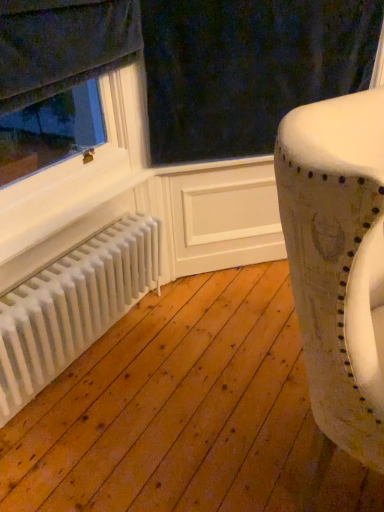
Question: In the image, is white matte radiator at lower left positioned in front of or behind distressed leather chair at right?

Choices:
 (A) front
 (B) behind

Answer: (B)

Question: In terms of size, does white matte radiator at lower left appear bigger or smaller than distressed leather chair at right?

Choices:
 (A) small
 (B) big

Answer: (A)

Question: Considering the positions of white matte radiator at lower left and distressed leather chair at right in the image, is white matte radiator at lower left taller or shorter than distressed leather chair at right?

Choices:
 (A) tall
 (B) short

Answer: (B)

Question: From the image's perspective, relative to white matte radiator at lower left, is distressed leather chair at right above or below?

Choices:
 (A) above
 (B) below

Answer: (A)

Question: Is distressed leather chair at right spatially inside white matte radiator at lower left, or outside of it?

Choices:
 (A) inside
 (B) outside

Answer: (B)

Question: In terms of height, does distressed leather chair at right look taller or shorter compared to white matte radiator at lower left?

Choices:
 (A) short
 (B) tall

Answer: (B)

Question: Relative to white matte radiator at lower left, is distressed leather chair at right in front or behind?

Choices:
 (A) behind
 (B) front

Answer: (B)